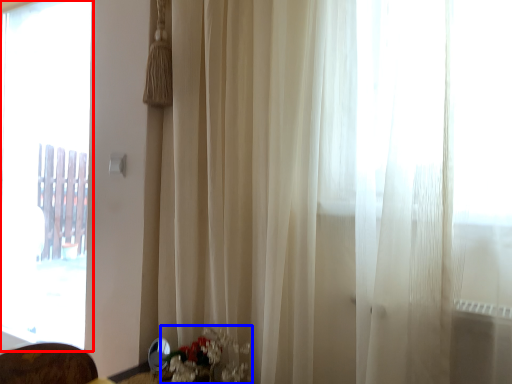
Question: Which object appears closest to the camera in this image, window (highlighted by a red box) or floral arrangement (highlighted by a blue box)?

Choices:
 (A) window
 (B) floral arrangement

Answer: (B)